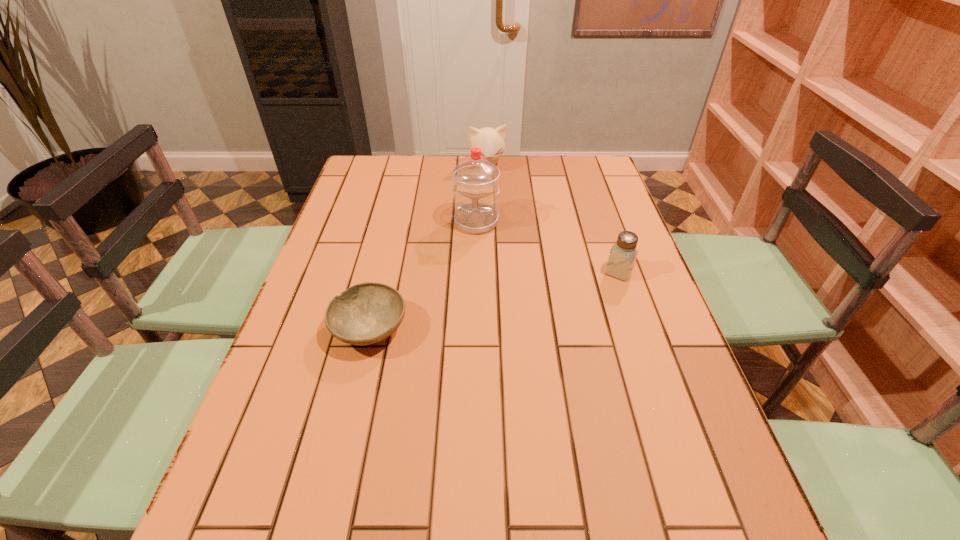
The image size is (960, 540). I want to click on the shortest object, so click(366, 313).

The height and width of the screenshot is (540, 960). Identify the location of the nearest object. (366, 313).

Image resolution: width=960 pixels, height=540 pixels. Identify the location of the third tallest object. (623, 254).

I want to click on the rightmost object, so click(x=623, y=254).

Find the location of a particular element. The image size is (960, 540). the second tallest object is located at coordinates (491, 141).

Locate an element on the screen. This screenshot has height=540, width=960. kitten is located at coordinates (491, 141).

Identify the location of water bottle. (475, 181).

Image resolution: width=960 pixels, height=540 pixels. Find the location of `the tallest object`. the tallest object is located at coordinates (475, 181).

Identify the location of free region located on the front of the nearest object. (335, 474).

Image resolution: width=960 pixels, height=540 pixels. I want to click on vacant space located on the left of the saltshaker, so click(559, 272).